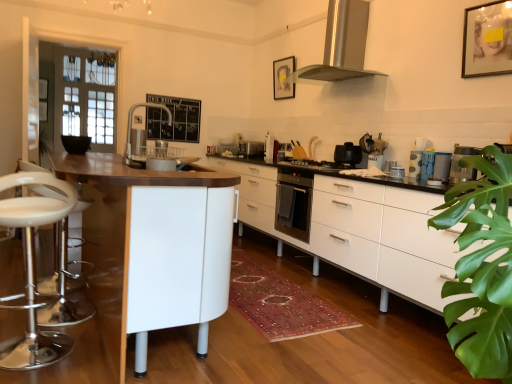
The height and width of the screenshot is (384, 512). Identify the location of free point behind white metallic swivel chair at left. (64, 314).